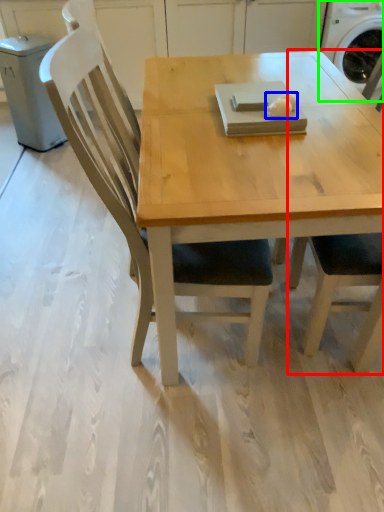
Question: Which is farther away from chair (highlighted by a red box)? food (highlighted by a blue box) or washing machine (highlighted by a green box)?

Choices:
 (A) food
 (B) washing machine

Answer: (B)